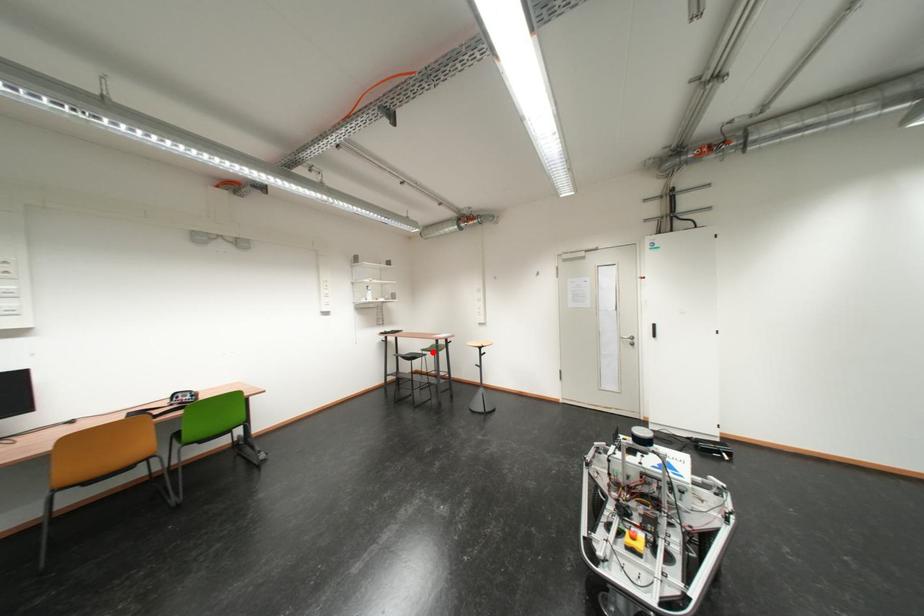
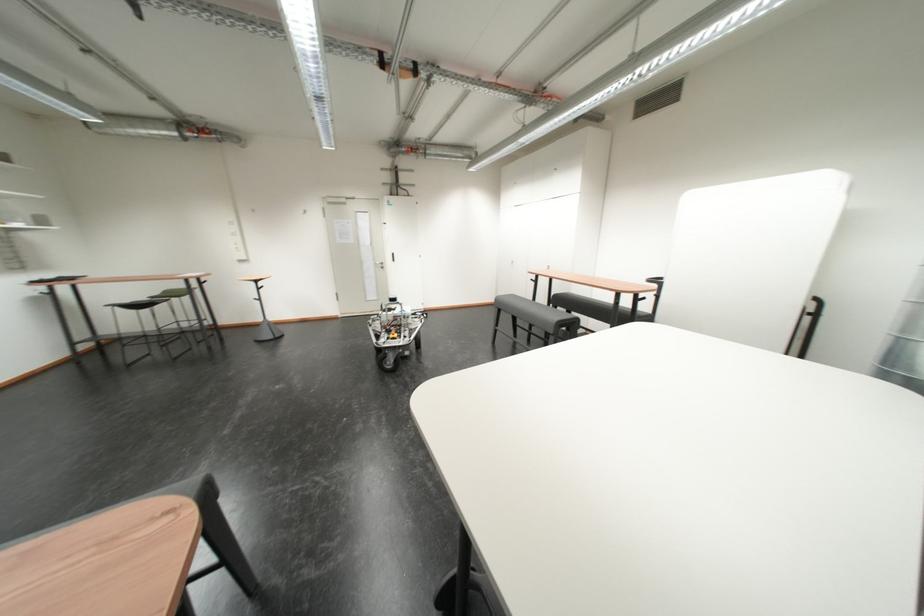
Find the pixel in the second image that matches the highlighted location in the first image.

(160, 300)